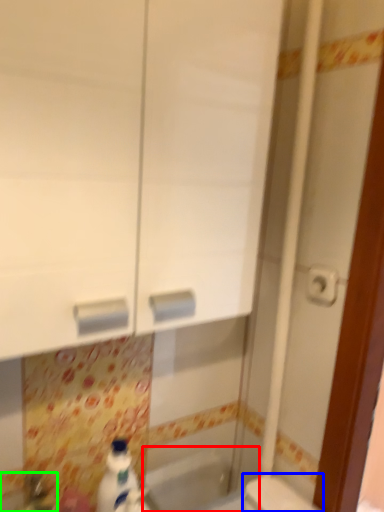
Question: Which is nearer to the bath (highlighted by a red box)? toilet (highlighted by a blue box) or sink (highlighted by a green box).

Choices:
 (A) toilet
 (B) sink

Answer: (A)